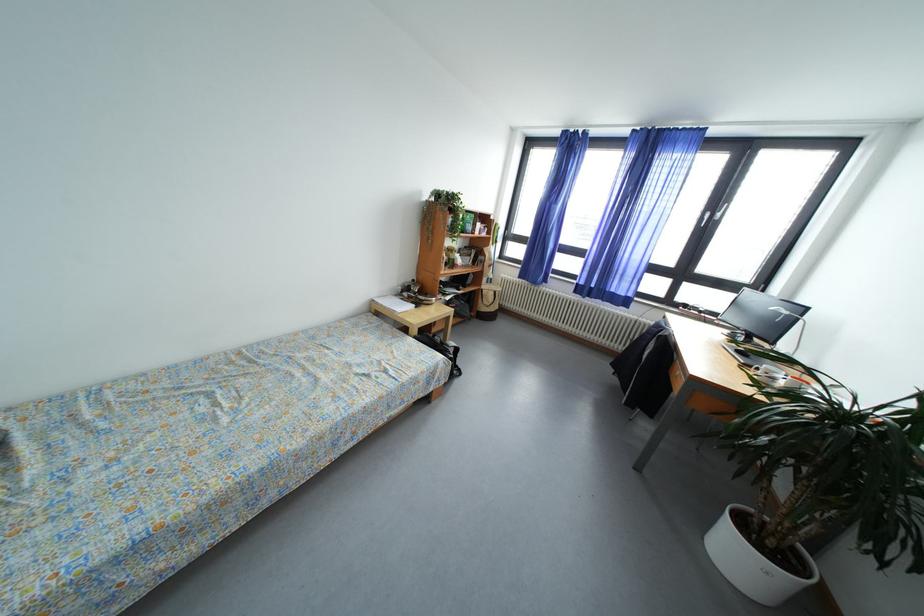
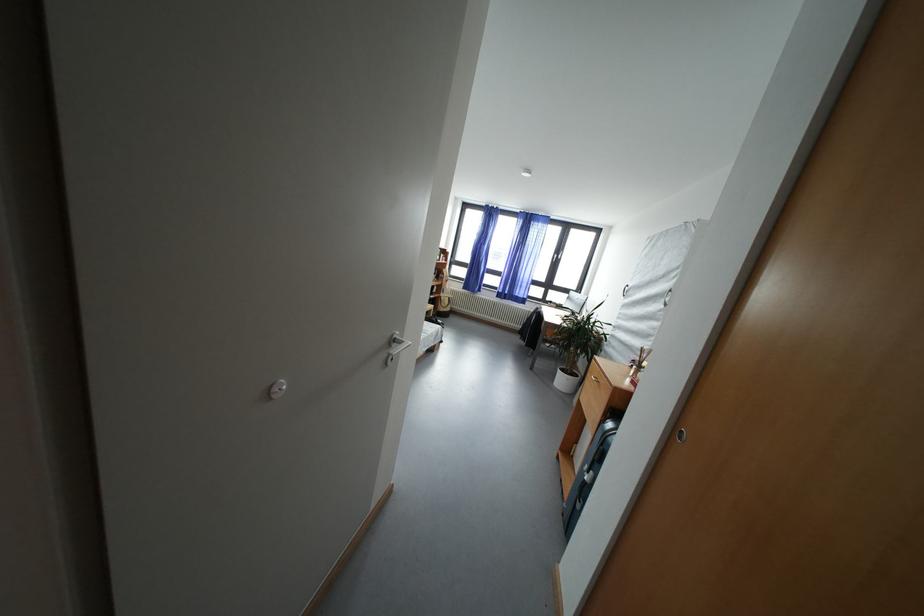
What movement of the cameraman would produce the second image?

The cameraman walked toward left, backward.